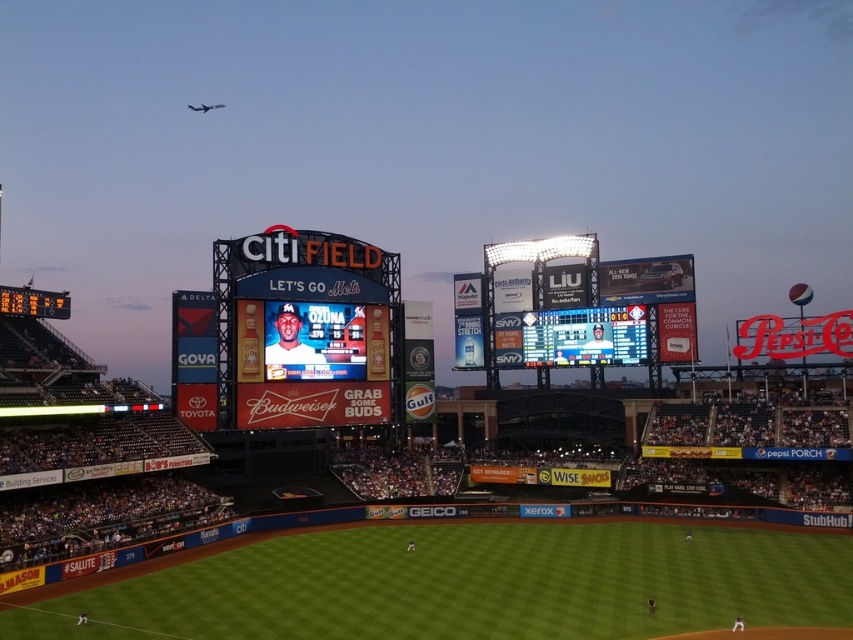
You are a fan standing in the stands at Citi Field and you want to take a photo of the orange digital scoreboard at left and the matte digital display at center in the same frame. Which one should you pan your camera towards first to include both in your photo?

You should pan your camera towards the orange digital scoreboard at left first because it is located to the left of the matte digital display at center, so capturing it first allows both to be included in the frame.

Looking at this image, you are standing at the camera position and want to throw a ball to hit the point at coordinates point (x=643, y=342). If your throwing range is 100 meters, will you be able to reach it?

The point (x=643, y=342) is 115.24 meters away from the camera. Since your throwing range is 100 meters, you cannot reach it.

You are a fan standing in the stands at Citi Field. You notice two digital screens ahead of you. One is labeled as the matte digital display at center and the other as the matte digital scoreboard at center. Which one do you think is bigger?

The matte digital display at center is larger in size compared to the matte digital scoreboard at center.